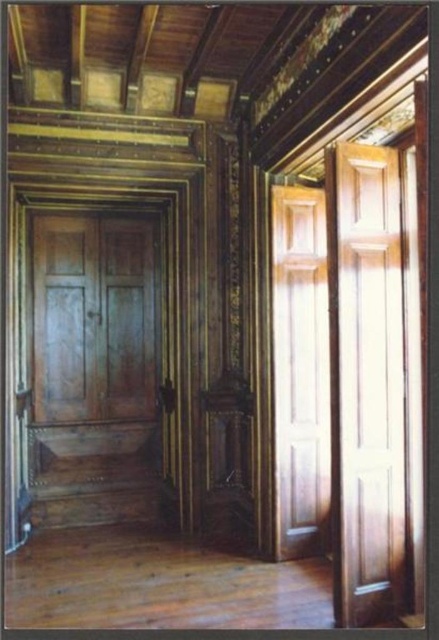
You are a contractor assessing the interior space. You notice the glossy wood door at right and the wooden paneling at right. Which object is taller?

The glossy wood door at right is taller than the wooden paneling at right.

Consider the image. You are standing in the room and want to exit through the wooden panelled door at center. Which direction should you move relative to the wooden paneling at right?

You should move to the left relative to the wooden paneling at right because the wooden panelled door at center is positioned to the left of the wooden paneling at right.